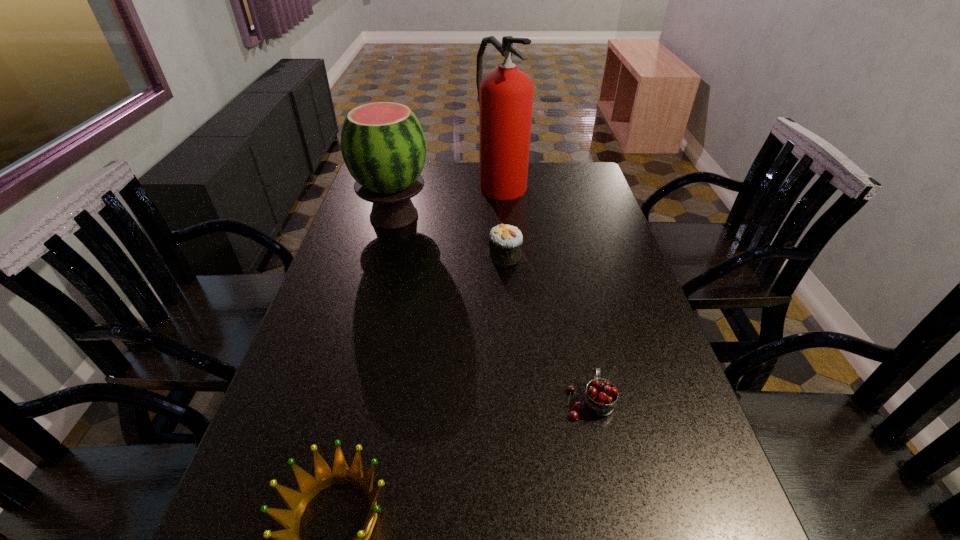
Identify the location of vacant space located on the handle side of the cherry. (576, 338).

In order to click on object that is at the far edge in this screenshot , I will do `click(505, 95)`.

I want to click on object that is at the left edge, so click(383, 145).

Identify the location of object located in the right edge section of the desktop. (600, 397).

Identify the location of free space at the far edge of the desktop. (549, 170).

Where is `vacant area at the left edge`? This screenshot has height=540, width=960. vacant area at the left edge is located at coordinates 354,334.

Image resolution: width=960 pixels, height=540 pixels. Identify the location of vacant space at the right edge. (624, 395).

In the image, there is a desktop. At what (x,y) coordinates should I click in order to perform the action: click on free space at the far right corner. Please return your answer as a coordinate pair (x, y). The width and height of the screenshot is (960, 540). Looking at the image, I should click on (593, 179).

You are a GUI agent. You are given a task and a screenshot of the screen. Output one action in this format:
    pyautogui.click(x=<x>, y=<y>)
    Task: Click on the vacant area that lies between the rightmost object and the cupcake
    This screenshot has height=540, width=960.
    Given the screenshot: What is the action you would take?
    pyautogui.click(x=547, y=328)

Locate an element on the screen. The height and width of the screenshot is (540, 960). free spot between the tallest object and the second tallest object is located at coordinates (447, 199).